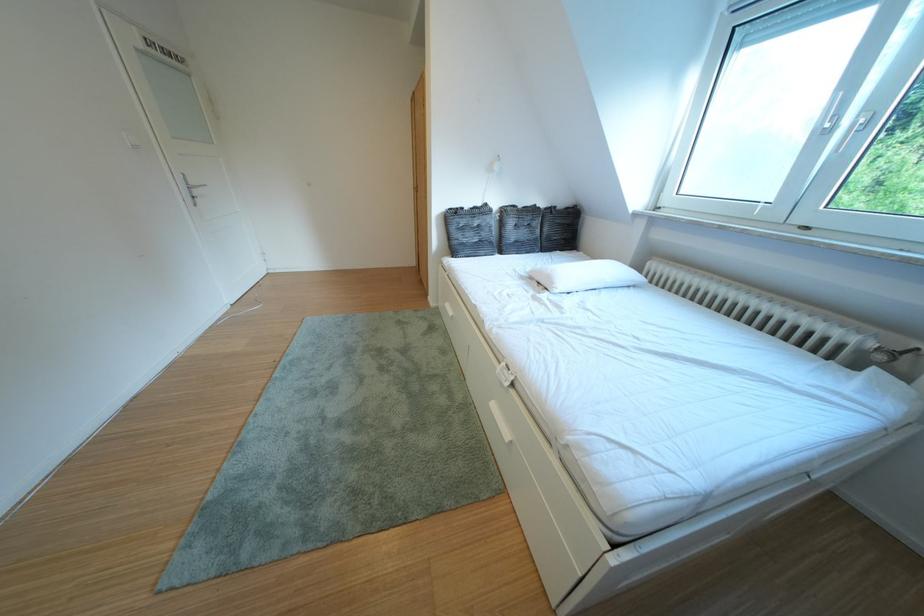
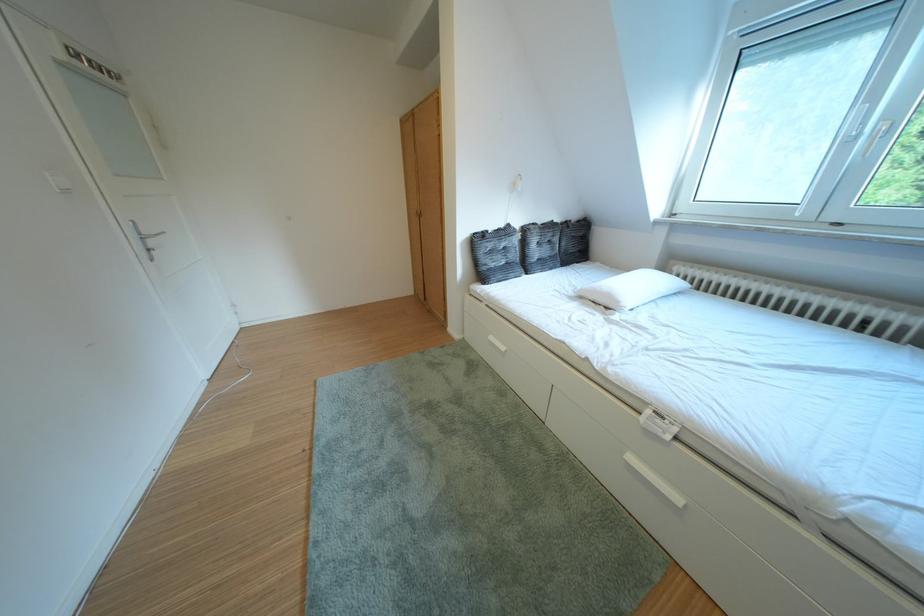
The point at (576, 208) is marked in the first image. Where is the corresponding point in the second image?

(588, 222)